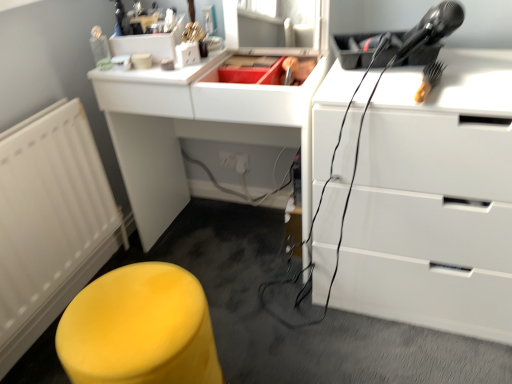
The image size is (512, 384). I want to click on free point to the left of yellow plastic brush at upper right, so click(x=366, y=86).